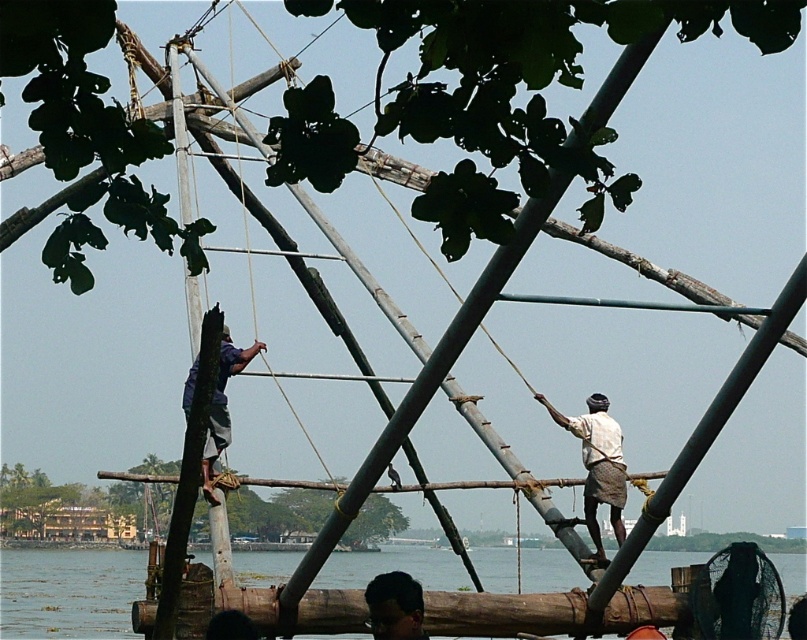
You are a photographer standing at the edge of the chandil structure. You notice a person wearing a white cotton shirt at right and another person with dark brown hair at lower center. Which of these two items is taller?

The white cotton shirt at right has a greater height compared to dark brown hair at lower center.

You are standing at the bottom edge of the image and want to reach the clear water at lower left. Which direction should you move in to get there?

You should move towards the lower left direction to reach the clear water at lower left from your current position at the bottom edge of the image.

You are standing on the bank of the river and see the clear water at lower left and dark brown hair at lower center. Which object is higher up in the scene?

The clear water at lower left is much taller than the dark brown hair at lower center, so the clear water at lower left is higher up in the scene.